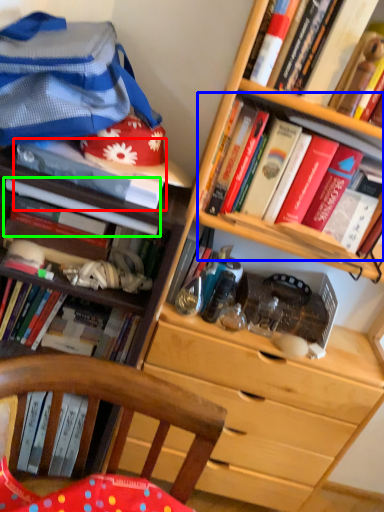
Question: Which object is the closest to the book (highlighted by a red box)? Choose among these: book (highlighted by a blue box) or book (highlighted by a green box).

Choices:
 (A) book
 (B) book

Answer: (B)